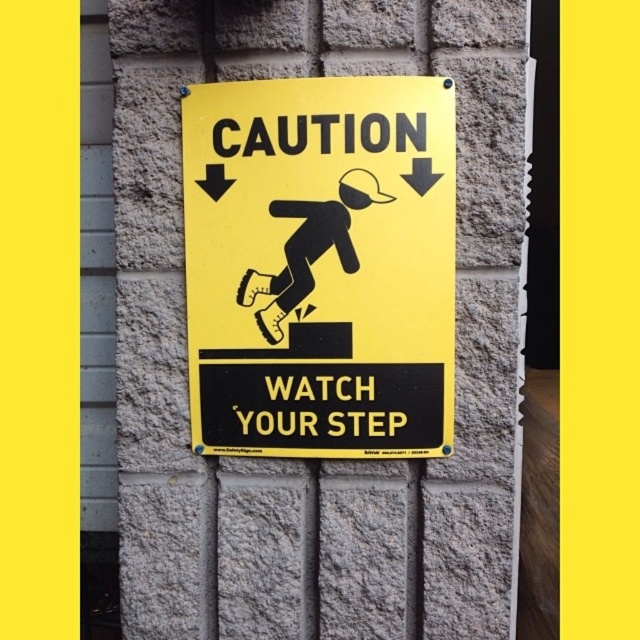
Can you confirm if yellow matte sign at center is smaller than black matte figure at center?

Actually, yellow matte sign at center might be larger than black matte figure at center.

Between yellow matte sign at center and black matte figure at center, which one has more height?

With more height is yellow matte sign at center.

Where is `yellow matte sign at center`? The image size is (640, 640). yellow matte sign at center is located at coordinates (321, 266).

Locate an element on the screen. yellow matte sign at center is located at coordinates (321, 266).